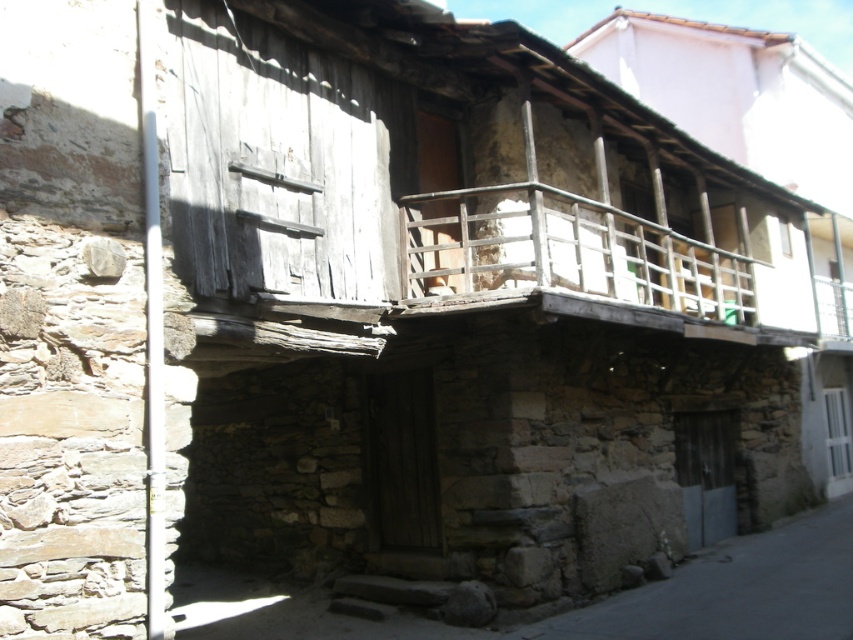
You are standing in the gray stone alley at lower right and want to look up at the wooden railing at upper center. In which direction should you look?

You should look upward because the wooden railing at upper center is located above the gray stone alley at lower right.